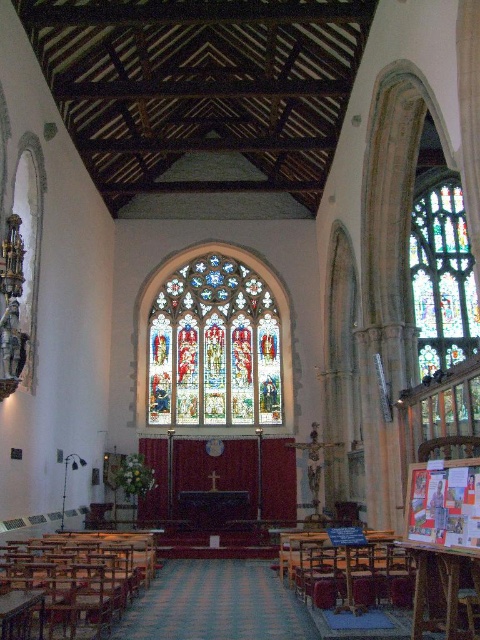
Question: Can you confirm if stained glass window at center is positioned below wooden polished chair at lower left?

Choices:
 (A) yes
 (B) no

Answer: (B)

Question: Can you confirm if wooden polished chair at lower left is positioned below stained glass window at right?

Choices:
 (A) yes
 (B) no

Answer: (A)

Question: Among these points, which one is nearest to the camera?

Choices:
 (A) (443, 324)
 (B) (340, 580)
 (C) (236, 332)

Answer: (B)

Question: Considering the real-world distances, which object is closest to the wooden chair at lower center?

Choices:
 (A) stained glass window at right
 (B) wooden polished chair at lower left

Answer: (B)

Question: Which of the following is the farthest from the observer?

Choices:
 (A) (339, 604)
 (B) (180, 346)
 (C) (432, 195)

Answer: (C)

Question: Is stained glass window at right positioned in front of wooden chair at lower center?

Choices:
 (A) no
 (B) yes

Answer: (A)